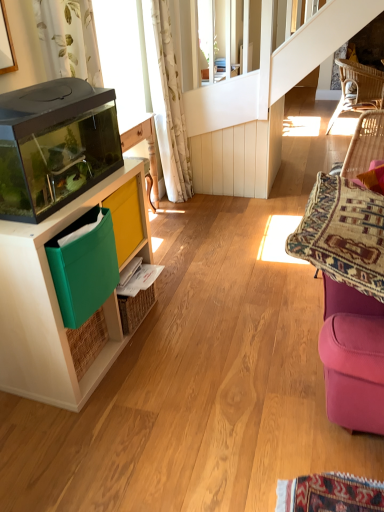
Where is `free area below white floral fabric curtain at upper left (from a real-world perspective)`? Image resolution: width=384 pixels, height=512 pixels. free area below white floral fabric curtain at upper left (from a real-world perspective) is located at coordinates (191, 195).